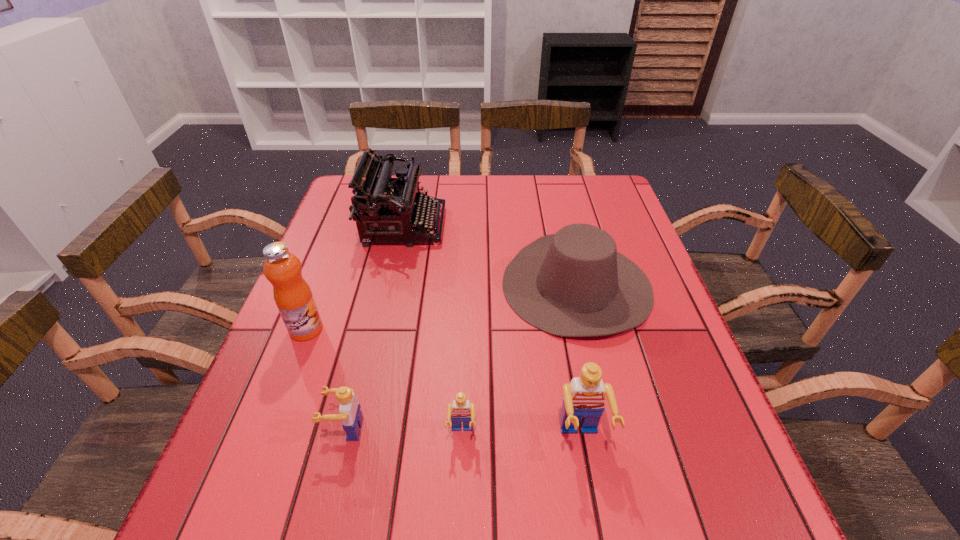
I want to click on the leftmost Lego, so click(x=350, y=415).

The width and height of the screenshot is (960, 540). Identify the location of the second Lego from right to left. (460, 410).

In order to click on the third object from right to left in this screenshot , I will do `click(460, 410)`.

I want to click on the rightmost Lego, so click(x=584, y=397).

At what (x,y) coordinates should I click in order to perform the action: click on typewriter. Please return your answer as a coordinate pair (x, y). The image size is (960, 540). Looking at the image, I should click on (385, 209).

Image resolution: width=960 pixels, height=540 pixels. What are the coordinates of `cowboy hat` in the screenshot? It's located at (574, 283).

Locate an element on the screen. the leftmost object is located at coordinates (294, 299).

The image size is (960, 540). Identify the location of the tallest object. (294, 299).

Image resolution: width=960 pixels, height=540 pixels. What are the coordinates of `vacant space located on the face of the leftmost Lego` in the screenshot? It's located at (247, 429).

Where is `vacant space situated 0.170m on the face of the leftmost Lego`? Image resolution: width=960 pixels, height=540 pixels. vacant space situated 0.170m on the face of the leftmost Lego is located at coordinates (236, 429).